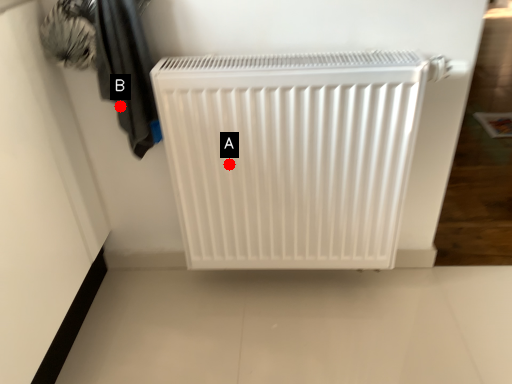
Question: Two points are circled on the image, labeled by A and B beside each circle. Among these points, which one is nearest to the camera?

Choices:
 (A) A is closer
 (B) B is closer

Answer: (B)